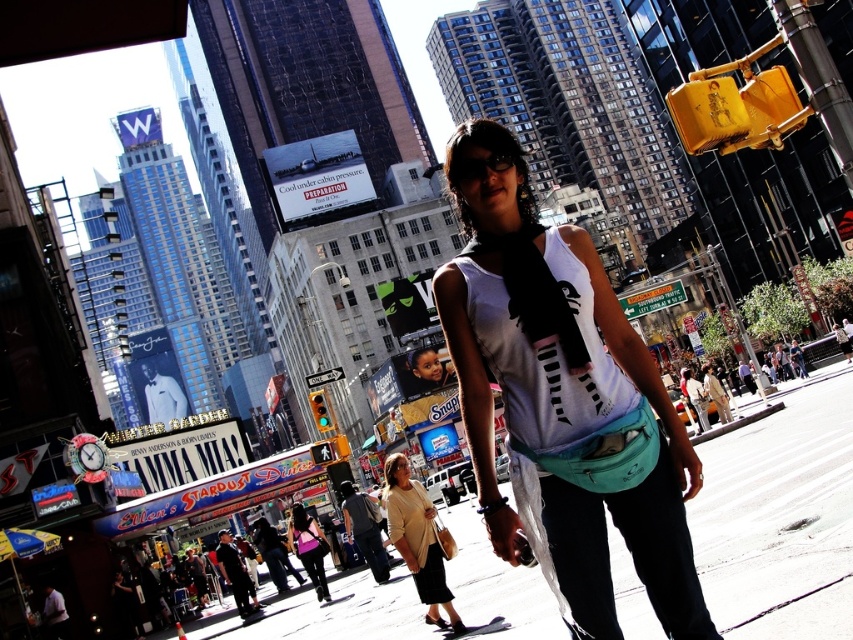
Can you confirm if beige fabric purse at center is thinner than matte black scarf at center?

Correct, beige fabric purse at center's width is less than matte black scarf at center's.

Does beige fabric purse at center come in front of matte black scarf at center?

That is True.

At what (x,y) coordinates should I click in order to perform the action: click on beige fabric purse at center. Please return your answer as a coordinate pair (x, y). Looking at the image, I should click on [x=418, y=540].

Locate an element on the screen. This screenshot has width=853, height=640. beige fabric purse at center is located at coordinates (418, 540).

Does point (367, 541) come in front of point (683, 385)?

That is True.

What do you see at coordinates (364, 531) in the screenshot? I see `dark gray cotton shirt at lower center` at bounding box center [364, 531].

Locate an element on the screen. dark gray cotton shirt at lower center is located at coordinates (364, 531).

Which is more to the left, smooth asphalt at lower center or dark gray cotton shirt at lower center?

dark gray cotton shirt at lower center

Does point (445, 509) come farther from viewer compared to point (370, 563)?

Yes, point (445, 509) is behind point (370, 563).

Is point (482, 598) behind point (375, 564)?

No, (482, 598) is in front of (375, 564).

Identify the location of smooth asphalt at lower center. (780, 516).